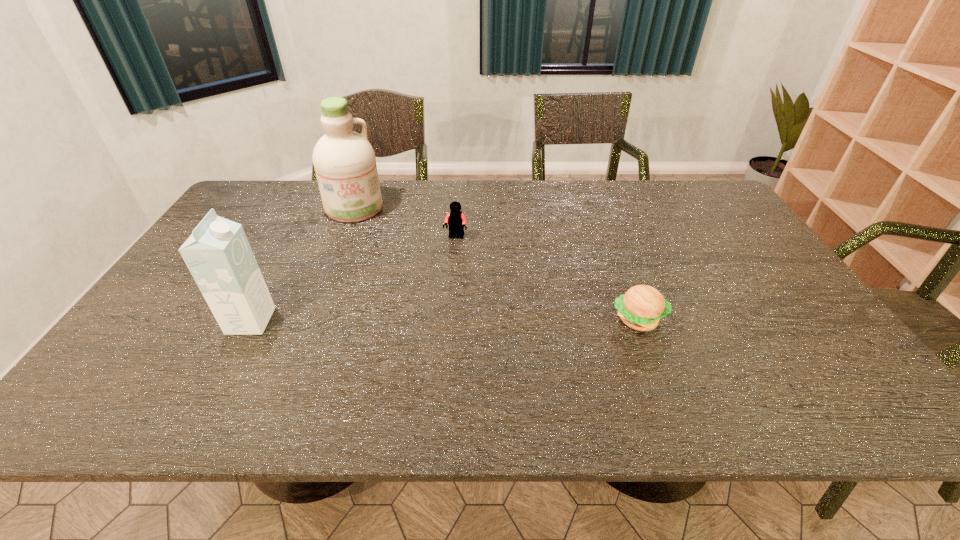
I want to click on the second tallest object, so click(217, 253).

What are the coordinates of `the leftmost object` in the screenshot? It's located at (217, 253).

You are a GUI agent. You are given a task and a screenshot of the screen. Output one action in this format:
    pyautogui.click(x=<x>, y=<y>)
    Task: Click on the rightmost object
    Image resolution: width=960 pixels, height=540 pixels.
    Given the screenshot: What is the action you would take?
    pyautogui.click(x=642, y=307)

Identify the location of the shortest object. This screenshot has width=960, height=540. (642, 307).

You are a GUI agent. You are given a task and a screenshot of the screen. Output one action in this format:
    pyautogui.click(x=<x>, y=<y>)
    Task: Click on the cleansing agent
    This screenshot has width=960, height=540.
    Given the screenshot: What is the action you would take?
    pyautogui.click(x=345, y=165)

In order to click on the farthest object in this screenshot , I will do `click(345, 165)`.

Where is `the second farthest object`? the second farthest object is located at coordinates (456, 221).

This screenshot has height=540, width=960. I want to click on the second shortest object, so click(x=456, y=221).

Identify the location of vacant region located 0.060m on the front label of the third shortest object. Image resolution: width=960 pixels, height=540 pixels. click(294, 321).

You are a GUI agent. You are given a task and a screenshot of the screen. Output one action in this format:
    pyautogui.click(x=<x>, y=<y>)
    Task: Click on the vacant region located 0.350m on the left of the shortest object
    The width and height of the screenshot is (960, 540).
    Given the screenshot: What is the action you would take?
    pyautogui.click(x=470, y=320)